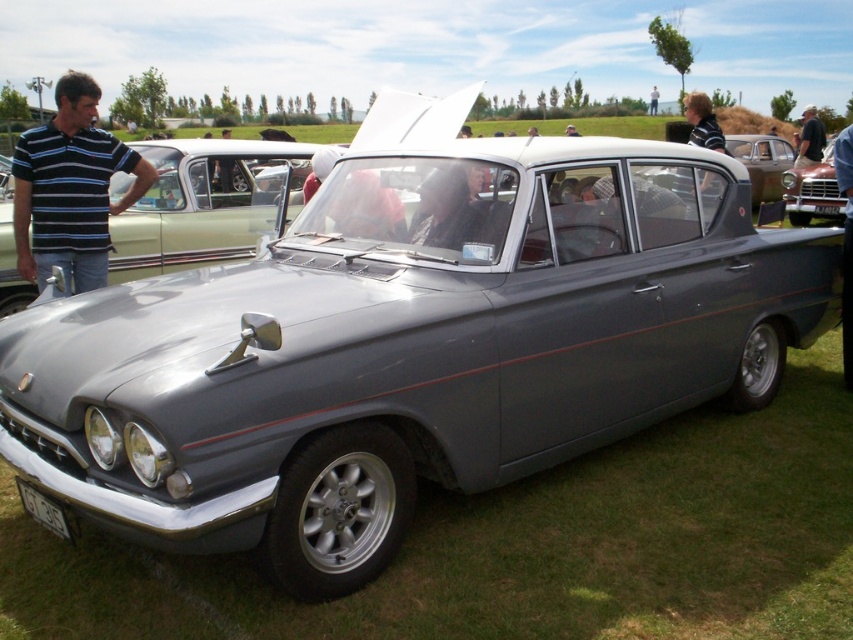
Question: Considering the relative positions of blue striped polo shirt at left and matte black shirt at center in the image provided, where is blue striped polo shirt at left located with respect to matte black shirt at center?

Choices:
 (A) left
 (B) right

Answer: (A)

Question: Which point appears farthest from the camera in this image?

Choices:
 (A) (845, 195)
 (B) (799, 225)

Answer: (B)

Question: Does matte black shirt at center lie in front of dark blue shirt at center?

Choices:
 (A) no
 (B) yes

Answer: (B)

Question: Estimate the real-world distances between objects in this image. Which object is closer to the blue striped polo shirt at left?

Choices:
 (A) dark blue shirt at center
 (B) matte black shirt at center
 (C) metallic red car at center

Answer: (B)

Question: Can you confirm if blue striped polo shirt at left is positioned below dark blue shirt at center?

Choices:
 (A) yes
 (B) no

Answer: (A)

Question: Which of the following is the closest to the observer?

Choices:
 (A) blue striped polo shirt at left
 (B) metallic red car at center
 (C) dark blue shirt at center
 (D) matte black shirt at center

Answer: (A)